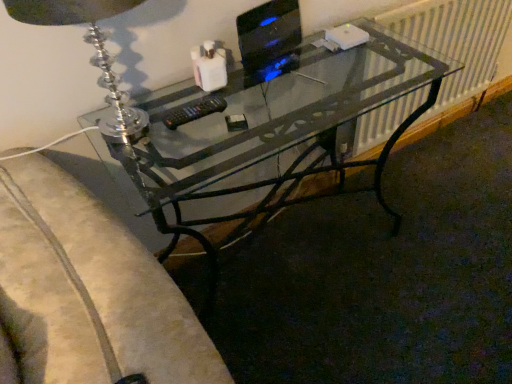
Question: Does black glossy monitor at upper right appear on the right side of clear glass table lamp at upper left?

Choices:
 (A) yes
 (B) no

Answer: (A)

Question: From the image's perspective, is black glossy monitor at upper right on top of clear glass table lamp at upper left?

Choices:
 (A) no
 (B) yes

Answer: (B)

Question: Does black glossy monitor at upper right have a greater height compared to clear glass table lamp at upper left?

Choices:
 (A) yes
 (B) no

Answer: (B)

Question: Does black glossy monitor at upper right have a larger size compared to clear glass table lamp at upper left?

Choices:
 (A) no
 (B) yes

Answer: (A)

Question: Considering the relative sizes of black glossy monitor at upper right and clear glass table lamp at upper left in the image provided, is black glossy monitor at upper right wider than clear glass table lamp at upper left?

Choices:
 (A) no
 (B) yes

Answer: (A)

Question: Would you say metallic silver radiator at right is inside or outside black glossy monitor at upper right?

Choices:
 (A) inside
 (B) outside

Answer: (B)

Question: From the image's perspective, is metallic silver radiator at right above or below black glossy monitor at upper right?

Choices:
 (A) below
 (B) above

Answer: (B)

Question: Considering the positions of metallic silver radiator at right and black glossy monitor at upper right in the image, is metallic silver radiator at right wider or thinner than black glossy monitor at upper right?

Choices:
 (A) wide
 (B) thin

Answer: (B)

Question: Would you say metallic silver radiator at right is to the left or to the right of black glossy monitor at upper right in the picture?

Choices:
 (A) right
 (B) left

Answer: (A)

Question: Considering the positions of clear glass table lamp at upper left and metallic silver radiator at right in the image, is clear glass table lamp at upper left wider or thinner than metallic silver radiator at right?

Choices:
 (A) wide
 (B) thin

Answer: (A)

Question: From a real-world perspective, is clear glass table lamp at upper left positioned above or below metallic silver radiator at right?

Choices:
 (A) above
 (B) below

Answer: (A)

Question: Is clear glass table lamp at upper left inside or outside of metallic silver radiator at right?

Choices:
 (A) outside
 (B) inside

Answer: (A)

Question: Based on their sizes in the image, would you say clear glass table lamp at upper left is bigger or smaller than metallic silver radiator at right?

Choices:
 (A) big
 (B) small

Answer: (B)

Question: From the image's perspective, is clear glass table lamp at upper left positioned above or below black plastic remote at center?

Choices:
 (A) below
 (B) above

Answer: (B)

Question: In terms of width, does clear glass table lamp at upper left look wider or thinner when compared to black plastic remote at center?

Choices:
 (A) thin
 (B) wide

Answer: (B)